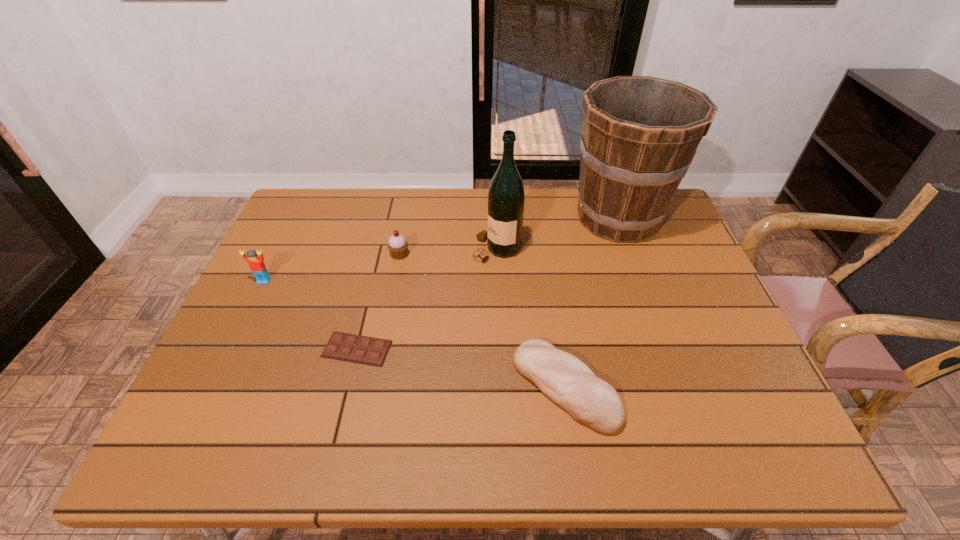
Identify the location of bucket. pyautogui.click(x=640, y=134).

Identify the location of wine bottle. (506, 198).

I want to click on the fourth farthest object, so click(256, 264).

At what (x,y) coordinates should I click in order to perform the action: click on the leftmost object. Please return your answer as a coordinate pair (x, y). The height and width of the screenshot is (540, 960). Looking at the image, I should click on (256, 264).

Where is `the fourth tallest object`? Image resolution: width=960 pixels, height=540 pixels. the fourth tallest object is located at coordinates (397, 245).

In order to click on bread in this screenshot , I will do `click(570, 383)`.

Identify the location of chocolate bar. (359, 349).

The height and width of the screenshot is (540, 960). Identify the location of vacant space located on the front of the bucket. (643, 289).

Find the location of a particular element. Image resolution: width=960 pixels, height=540 pixels. vacant region located on the surface of the wine bottle is located at coordinates (415, 249).

Locate an element on the screen. This screenshot has height=540, width=960. blank area located on the surface of the wine bottle is located at coordinates (385, 249).